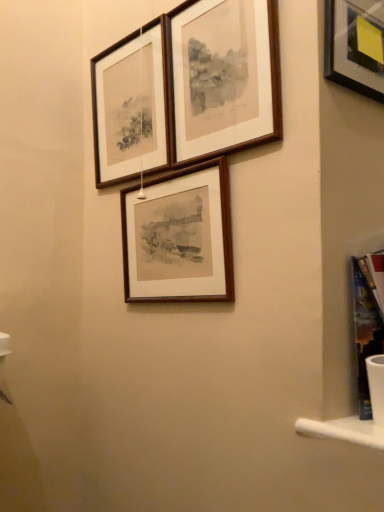
This screenshot has height=512, width=384. I want to click on wooden frame at center, which is the 1th picture frame in bottom-to-top order, so click(x=180, y=237).

What is the approximate width of wooden frame at upper center, arranged as the third picture frame when ordered from the bottom?

It is 1.09 inches.

Locate an element on the screen. The height and width of the screenshot is (512, 384). wooden frame at upper center, arranged as the third picture frame when ordered from the bottom is located at coordinates (223, 77).

This screenshot has height=512, width=384. What do you see at coordinates (130, 106) in the screenshot? I see `wooden frame at upper center, the 2th picture frame from the bottom` at bounding box center [130, 106].

You are a GUI agent. You are given a task and a screenshot of the screen. Output one action in this format:
    pyautogui.click(x=<x>, y=<y>)
    Task: Click on the wooden frame at center, which is the 1th picture frame in bottom-to-top order
    The height and width of the screenshot is (512, 384).
    Given the screenshot: What is the action you would take?
    pyautogui.click(x=180, y=237)

From the image's perspective, is wooden frame at center, the 3th picture frame positioned from the top, on wooden frame at upper center, arranged as the third picture frame when ordered from the bottom?

No, from the image's perspective, wooden frame at center, the 3th picture frame positioned from the top, is not over wooden frame at upper center, arranged as the third picture frame when ordered from the bottom.

The image size is (384, 512). Find the location of `the 2nd picture frame above when counting from the wooden frame at center, which is the 1th picture frame in bottom-to-top order (from the image's perspective)`. the 2nd picture frame above when counting from the wooden frame at center, which is the 1th picture frame in bottom-to-top order (from the image's perspective) is located at coordinates (223, 77).

Is wooden frame at center, the 3th picture frame positioned from the top, at the left side of wooden frame at upper center, arranged as the third picture frame when ordered from the bottom?

Yes.

Is point (228, 247) closer or farther from the camera than point (220, 69)?

Point (228, 247) is positioned closer to the camera compared to point (220, 69).

Considering the sizes of objects wooden frame at center, the 3th picture frame positioned from the top, and wooden frame at upper center, the 2th picture frame when ordered from top to bottom, in the image provided, who is bigger, wooden frame at center, the 3th picture frame positioned from the top, or wooden frame at upper center, the 2th picture frame when ordered from top to bottom,?

wooden frame at upper center, the 2th picture frame when ordered from top to bottom.

Is wooden frame at center, the 3th picture frame positioned from the top, positioned with its back to wooden frame at upper center, the 2th picture frame from the bottom?

That's not correct — wooden frame at center, the 3th picture frame positioned from the top, is not looking away from wooden frame at upper center, the 2th picture frame from the bottom.

Considering the relative sizes of wooden frame at center, the 3th picture frame positioned from the top, and wooden frame at upper center, the 2th picture frame when ordered from top to bottom, in the image provided, is wooden frame at center, the 3th picture frame positioned from the top, wider than wooden frame at upper center, the 2th picture frame when ordered from top to bottom,?

Yes.

Is the surface of wooden frame at center, the 3th picture frame positioned from the top, in direct contact with wooden frame at upper center, the 2th picture frame from the bottom?

No, wooden frame at center, the 3th picture frame positioned from the top, is not beside wooden frame at upper center, the 2th picture frame from the bottom.

In terms of width, does wooden frame at upper center, the 2th picture frame when ordered from top to bottom, look wider or thinner when compared to wooden frame at upper center, arranged as the third picture frame when ordered from the bottom?

In the image, wooden frame at upper center, the 2th picture frame when ordered from top to bottom, appears to be wider than wooden frame at upper center, arranged as the third picture frame when ordered from the bottom.

Who is bigger, wooden frame at upper center, the 2th picture frame when ordered from top to bottom, or wooden frame at upper center, arranged as the third picture frame when ordered from the bottom?

wooden frame at upper center, the 2th picture frame when ordered from top to bottom.

What's the angular difference between wooden frame at upper center, the 2th picture frame when ordered from top to bottom, and wooden frame at upper center, which appears as the 1th picture frame when viewed from the top,'s facing directions?

There is a 2.52-degree angle between the facing directions of wooden frame at upper center, the 2th picture frame when ordered from top to bottom, and wooden frame at upper center, which appears as the 1th picture frame when viewed from the top.

From the image's perspective, which one is positioned higher, wooden frame at upper center, the 2th picture frame from the bottom, or wooden frame at upper center, arranged as the third picture frame when ordered from the bottom?

From the image's view, wooden frame at upper center, arranged as the third picture frame when ordered from the bottom, is above.

From the image's perspective, is wooden frame at upper center, the 2th picture frame when ordered from top to bottom, under wooden frame at center, which is the 1th picture frame in bottom-to-top order?

Actually, wooden frame at upper center, the 2th picture frame when ordered from top to bottom, appears above wooden frame at center, which is the 1th picture frame in bottom-to-top order, in the image.

From the picture: Is wooden frame at upper center, the 2th picture frame when ordered from top to bottom, with wooden frame at center, which is the 1th picture frame in bottom-to-top order?

No, wooden frame at upper center, the 2th picture frame when ordered from top to bottom, is not with wooden frame at center, which is the 1th picture frame in bottom-to-top order.

Between wooden frame at upper center, the 2th picture frame when ordered from top to bottom, and wooden frame at center, which is the 1th picture frame in bottom-to-top order, which one has larger width?

wooden frame at center, which is the 1th picture frame in bottom-to-top order.

Is wooden frame at upper center, the 2th picture frame from the bottom, bigger or smaller than wooden frame at center, the 3th picture frame positioned from the top?

Considering their sizes, wooden frame at upper center, the 2th picture frame from the bottom, takes up more space than wooden frame at center, the 3th picture frame positioned from the top.

From the image's perspective, does wooden frame at upper center, which appears as the 1th picture frame when viewed from the top, appear higher than wooden frame at center, which is the 1th picture frame in bottom-to-top order?

Yes, from the image's perspective, wooden frame at upper center, which appears as the 1th picture frame when viewed from the top, is over wooden frame at center, which is the 1th picture frame in bottom-to-top order.

Considering their positions, is wooden frame at upper center, which appears as the 1th picture frame when viewed from the top, located in front of or behind wooden frame at center, which is the 1th picture frame in bottom-to-top order?

In the image, wooden frame at upper center, which appears as the 1th picture frame when viewed from the top, appears in front of wooden frame at center, which is the 1th picture frame in bottom-to-top order.

Is wooden frame at upper center, which appears as the 1th picture frame when viewed from the top, wider or thinner than wooden frame at center, which is the 1th picture frame in bottom-to-top order?

wooden frame at upper center, which appears as the 1th picture frame when viewed from the top, is thinner than wooden frame at center, which is the 1th picture frame in bottom-to-top order.

Considering the relative sizes of wooden frame at upper center, which appears as the 1th picture frame when viewed from the top, and wooden frame at upper center, the 2th picture frame when ordered from top to bottom, in the image provided, is wooden frame at upper center, which appears as the 1th picture frame when viewed from the top, smaller than wooden frame at upper center, the 2th picture frame when ordered from top to bottom,?

Indeed, wooden frame at upper center, which appears as the 1th picture frame when viewed from the top, has a smaller size compared to wooden frame at upper center, the 2th picture frame when ordered from top to bottom.

Measure the distance between wooden frame at upper center, arranged as the third picture frame when ordered from the bottom, and wooden frame at upper center, the 2th picture frame when ordered from top to bottom.

wooden frame at upper center, arranged as the third picture frame when ordered from the bottom, and wooden frame at upper center, the 2th picture frame when ordered from top to bottom, are 6.03 inches apart from each other.

Does wooden frame at upper center, which appears as the 1th picture frame when viewed from the top, have a greater width compared to wooden frame at upper center, the 2th picture frame when ordered from top to bottom?

No, wooden frame at upper center, which appears as the 1th picture frame when viewed from the top, is not wider than wooden frame at upper center, the 2th picture frame when ordered from top to bottom.

From the image's perspective, which object appears higher, wooden frame at upper center, which appears as the 1th picture frame when viewed from the top, or wooden frame at upper center, the 2th picture frame when ordered from top to bottom?

wooden frame at upper center, which appears as the 1th picture frame when viewed from the top, is shown above in the image.

This screenshot has width=384, height=512. Identify the location of picture frame lying in front of the wooden frame at center, which is the 1th picture frame in bottom-to-top order. (223, 77).

You are a GUI agent. You are given a task and a screenshot of the screen. Output one action in this format:
    pyautogui.click(x=<x>, y=<y>)
    Task: Click on the picture frame that is below the wooden frame at upper center, the 2th picture frame from the bottom (from the image's perspective)
    The height and width of the screenshot is (512, 384).
    Given the screenshot: What is the action you would take?
    pyautogui.click(x=180, y=237)

Estimate the real-world distances between objects in this image. Which object is closer to wooden frame at upper center, the 2th picture frame when ordered from top to bottom, wooden frame at upper center, arranged as the third picture frame when ordered from the bottom, or wooden frame at center, which is the 1th picture frame in bottom-to-top order?

The object closer to wooden frame at upper center, the 2th picture frame when ordered from top to bottom, is wooden frame at upper center, arranged as the third picture frame when ordered from the bottom.

Estimate the real-world distances between objects in this image. Which object is further from wooden frame at upper center, which appears as the 1th picture frame when viewed from the top, wooden frame at upper center, the 2th picture frame when ordered from top to bottom, or wooden frame at center, the 3th picture frame positioned from the top?

wooden frame at center, the 3th picture frame positioned from the top, is positioned further to the anchor wooden frame at upper center, which appears as the 1th picture frame when viewed from the top.

Considering their positions, is wooden frame at center, the 3th picture frame positioned from the top, positioned further to wooden frame at upper center, arranged as the third picture frame when ordered from the bottom, than wooden frame at upper center, the 2th picture frame from the bottom?

wooden frame at center, the 3th picture frame positioned from the top, is positioned further to the anchor wooden frame at upper center, arranged as the third picture frame when ordered from the bottom.

In the scene shown: Estimate the real-world distances between objects in this image. Which object is closer to wooden frame at center, the 3th picture frame positioned from the top, wooden frame at upper center, the 2th picture frame from the bottom, or wooden frame at upper center, which appears as the 1th picture frame when viewed from the top?

wooden frame at upper center, which appears as the 1th picture frame when viewed from the top, is closer to wooden frame at center, the 3th picture frame positioned from the top.

Estimate the real-world distances between objects in this image. Which object is closer to wooden frame at upper center, the 2th picture frame when ordered from top to bottom, wooden frame at center, the 3th picture frame positioned from the top, or wooden frame at upper center, arranged as the third picture frame when ordered from the bottom?

wooden frame at upper center, arranged as the third picture frame when ordered from the bottom, is closer to wooden frame at upper center, the 2th picture frame when ordered from top to bottom.

Looking at the image, which one is located further to wooden frame at center, which is the 1th picture frame in bottom-to-top order, wooden frame at upper center, arranged as the third picture frame when ordered from the bottom, or wooden frame at upper center, the 2th picture frame when ordered from top to bottom?

Based on the image, wooden frame at upper center, the 2th picture frame when ordered from top to bottom, appears to be further to wooden frame at center, which is the 1th picture frame in bottom-to-top order.

Locate an element on the screen. picture frame between wooden frame at upper center, arranged as the third picture frame when ordered from the bottom, and wooden frame at center, which is the 1th picture frame in bottom-to-top order, from top to bottom is located at coordinates (130, 106).